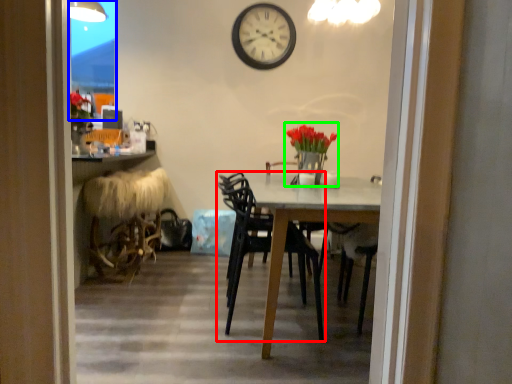
Question: Which object is the farthest from chair (highlighted by a red box)? Choose among these: glass door (highlighted by a blue box) or floral arrangement (highlighted by a green box).

Choices:
 (A) glass door
 (B) floral arrangement

Answer: (A)